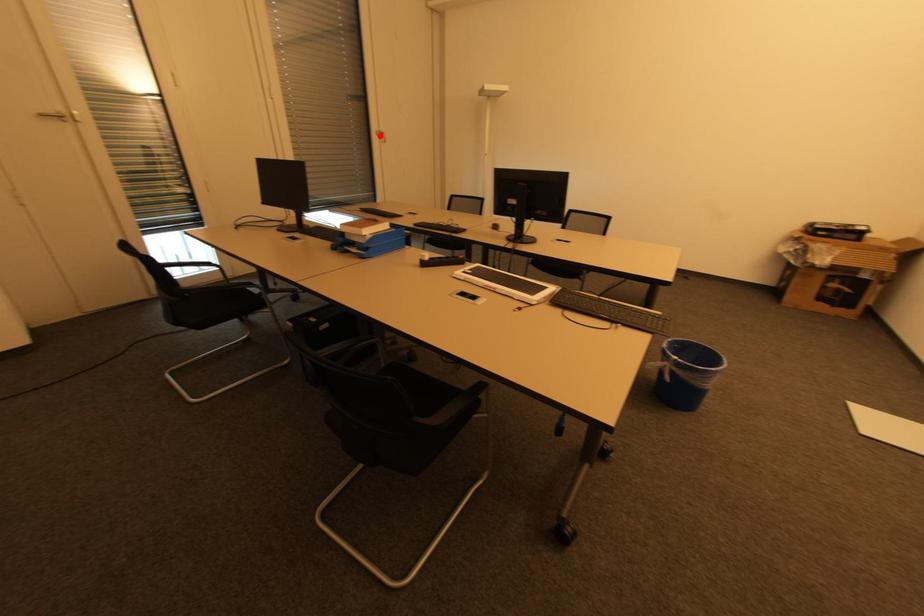
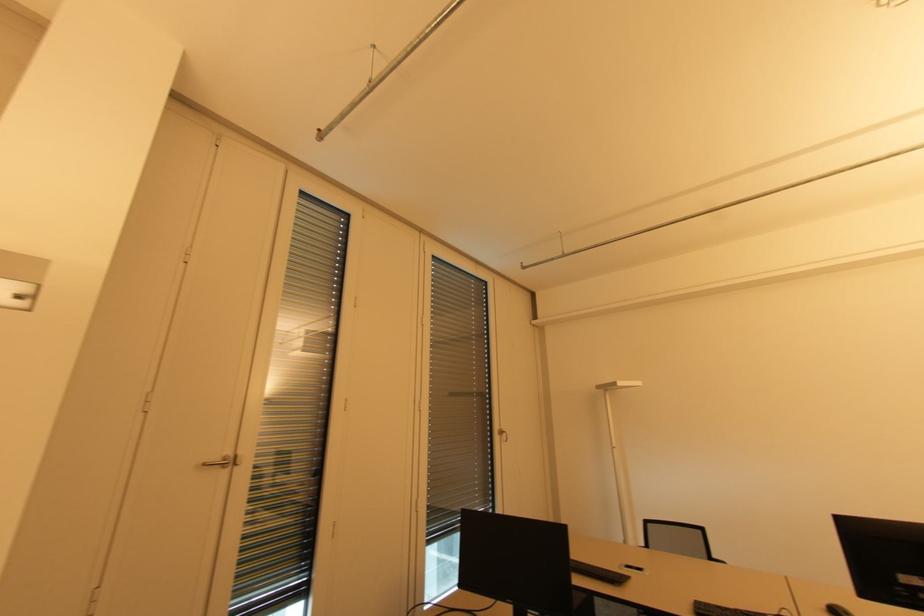
Question: A red point is marked in image1. In image2, is the corresponding 3D point closer to the camera or farther? Reply with the corresponding letter.

Choices:
 (A) The corresponding 3D point is closer.
 (B) The corresponding 3D point is farther.

Answer: (B)